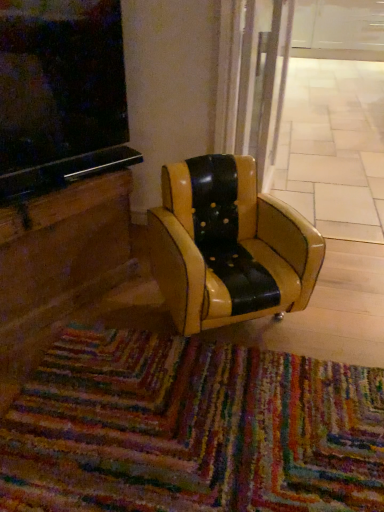
Question: Is black leather chair at center bigger or smaller than multicolored woven mat at lower center?

Choices:
 (A) big
 (B) small

Answer: (A)

Question: From the image's perspective, relative to multicolored woven mat at lower center, is black leather chair at center above or below?

Choices:
 (A) above
 (B) below

Answer: (A)

Question: Based on their relative distances, which object is nearer to the black leather chair at center?

Choices:
 (A) multicolored woven mat at lower center
 (B) transparent glass door at center

Answer: (A)

Question: Which is farther from the black leather chair at center?

Choices:
 (A) transparent glass door at center
 (B) multicolored woven mat at lower center

Answer: (A)